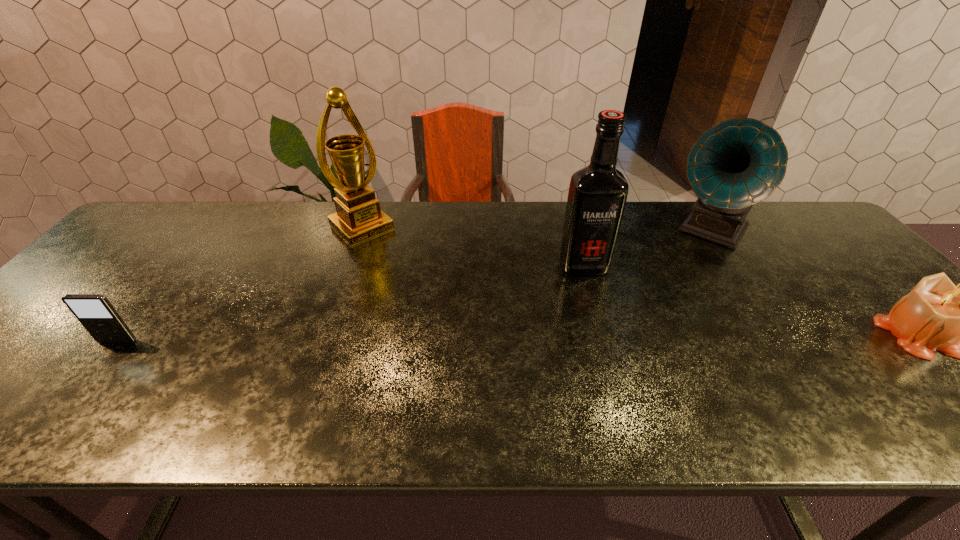
Image resolution: width=960 pixels, height=540 pixels. Find the location of `iPod`. iPod is located at coordinates (95, 312).

I want to click on the leftmost object, so click(95, 312).

Identify the location of the third tallest object. This screenshot has width=960, height=540. (737, 163).

At what (x,y) coordinates should I click in order to perform the action: click on the second object from right to left. Please return your answer as a coordinate pair (x, y). Looking at the image, I should click on (737, 163).

Locate an element on the screen. award is located at coordinates (358, 218).

Identify the location of the third object from right to left. (597, 195).

Image resolution: width=960 pixels, height=540 pixels. I want to click on vacant region located on the front-facing side of the iPod, so click(89, 376).

Image resolution: width=960 pixels, height=540 pixels. I want to click on vacant space located 0.330m from the horn of the phonograph_record, so click(651, 321).

The height and width of the screenshot is (540, 960). I want to click on free point located 0.220m from the horn of the phonograph_record, so click(x=667, y=296).

You are a GUI agent. You are given a task and a screenshot of the screen. Output one action in this format:
    pyautogui.click(x=<x>, y=<y>)
    Task: Click on the vacant space located 0.050m from the horn of the phonograph_record
    This screenshot has height=540, width=960.
    Given the screenshot: What is the action you would take?
    click(x=689, y=263)